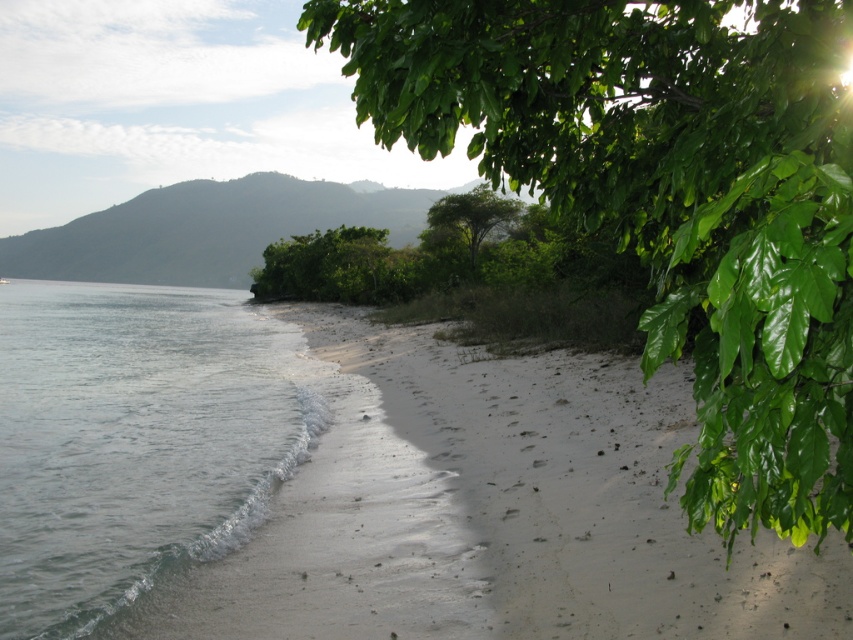
You are standing at the center of the beach looking towards the mountains. There is a point marked at coordinates (x=666, y=196). What object is located at this point?

The point at (x=666, y=196) marks the location of the green leafy tree at upper right.

You are standing on the beach and want to take a photo of both the clear water at lower left and the green leafy tree at center. Which object should you zoom in on to ensure both fit in the frame?

The clear water at lower left is bigger than the green leafy tree at center. To ensure both fit in the frame, you should zoom out slightly so that the larger clear water at lower left doesn t fill the frame completely, allowing space for the smaller green leafy tree at center.